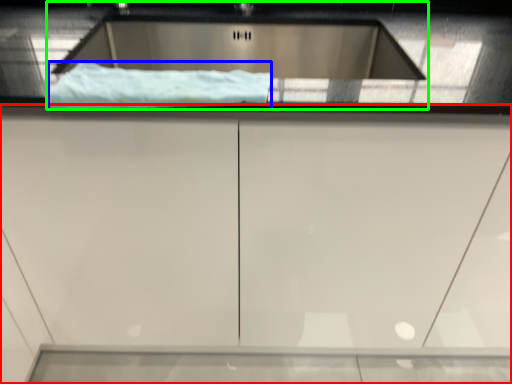
Question: Considering the real-world distances, which object is closest to cabinetry (highlighted by a red box)? material (highlighted by a blue box) or sink (highlighted by a green box).

Choices:
 (A) material
 (B) sink

Answer: (A)